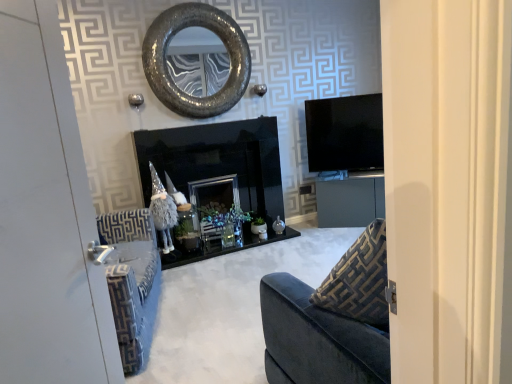
Question: Can we say white painted wood door at left lies outside textured metallic mirror at upper center?

Choices:
 (A) yes
 (B) no

Answer: (A)

Question: From the image's perspective, is white painted wood door at left beneath textured metallic mirror at upper center?

Choices:
 (A) yes
 (B) no

Answer: (A)

Question: Can you confirm if white painted wood door at left is smaller than textured metallic mirror at upper center?

Choices:
 (A) no
 (B) yes

Answer: (B)

Question: Can you confirm if white painted wood door at left is positioned to the left of textured metallic mirror at upper center?

Choices:
 (A) yes
 (B) no

Answer: (B)

Question: Is white painted wood door at left aimed at textured metallic mirror at upper center?

Choices:
 (A) yes
 (B) no

Answer: (B)

Question: Considering the relative sizes of white painted wood door at left and textured metallic mirror at upper center in the image provided, is white painted wood door at left taller than textured metallic mirror at upper center?

Choices:
 (A) yes
 (B) no

Answer: (A)

Question: Can you confirm if textured metallic mirror at upper center is wider than matte gray cabinet at center?

Choices:
 (A) yes
 (B) no

Answer: (B)

Question: Is textured metallic mirror at upper center far from matte gray cabinet at center?

Choices:
 (A) yes
 (B) no

Answer: (A)

Question: Considering the relative sizes of textured metallic mirror at upper center and matte gray cabinet at center in the image provided, is textured metallic mirror at upper center bigger than matte gray cabinet at center?

Choices:
 (A) yes
 (B) no

Answer: (B)

Question: Considering the relative sizes of textured metallic mirror at upper center and matte gray cabinet at center in the image provided, is textured metallic mirror at upper center thinner than matte gray cabinet at center?

Choices:
 (A) yes
 (B) no

Answer: (A)

Question: Is textured metallic mirror at upper center positioned with its back to matte gray cabinet at center?

Choices:
 (A) yes
 (B) no

Answer: (B)

Question: From the image's perspective, is textured metallic mirror at upper center located above matte gray cabinet at center?

Choices:
 (A) no
 (B) yes

Answer: (B)

Question: Does textured metallic mirror at upper center have a greater width compared to black glossy fireplace at center?

Choices:
 (A) no
 (B) yes

Answer: (A)